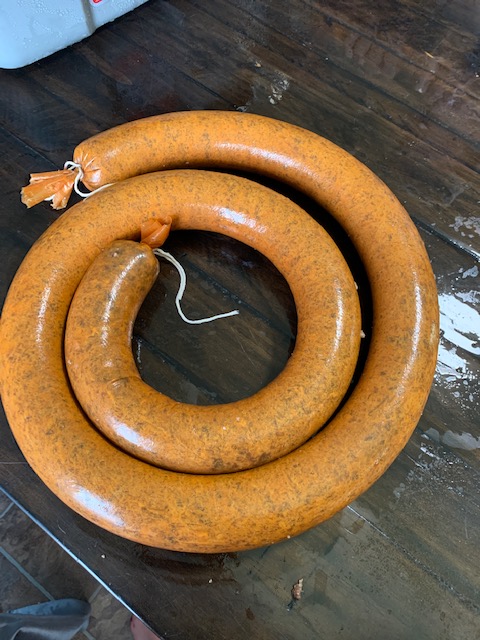
At what (x,y) coordinates should I click in order to perform the action: click on table. Please return your answer as a coordinate pair (x, y). Looking at the image, I should click on (240, 264), (239, 605).